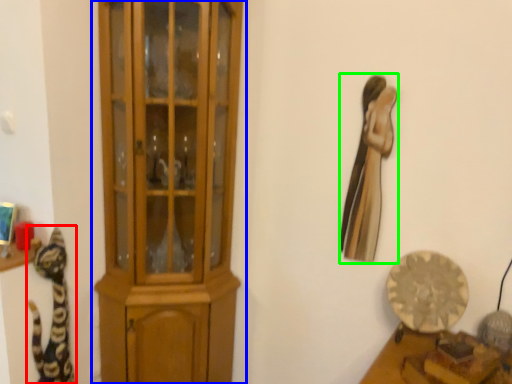
Question: Based on their relative distances, which object is farther from cat (highlighted by a red box)? Choose from cupboard (highlighted by a blue box) and animal (highlighted by a green box).

Choices:
 (A) cupboard
 (B) animal

Answer: (B)